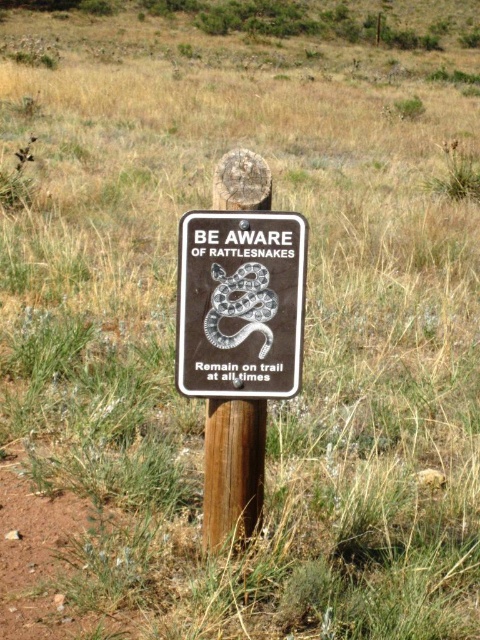
Looking at this image, you are a hiker who just arrived at the trailhead and see the black matte sign at center. You want to read the text on the sign without moving closer. Can you do that from your current position, given that the average reading distance for such signs is 10 feet?

The distance between you and the black matte sign at center is 8.62 feet, which is less than the average reading distance of 10 feet. Therefore, you can read the text on the black matte sign at center from your current position.

In the scene shown: You are a hiker who wants to take a photo of the warning sign. Since you want the sign to look bigger in the photo, should you move closer to the black matte sign at center or the brown wood post at center?

The black matte sign at center is smaller than the brown wood post at center. To make the sign appear larger in the photo, you should move closer to the black matte sign at center.

You are a hiker who just spotted the black matte sign at center and the brown wood post at center. Which object is nearer to you?

The black matte sign at center is closer to the viewer than the brown wood post at center.